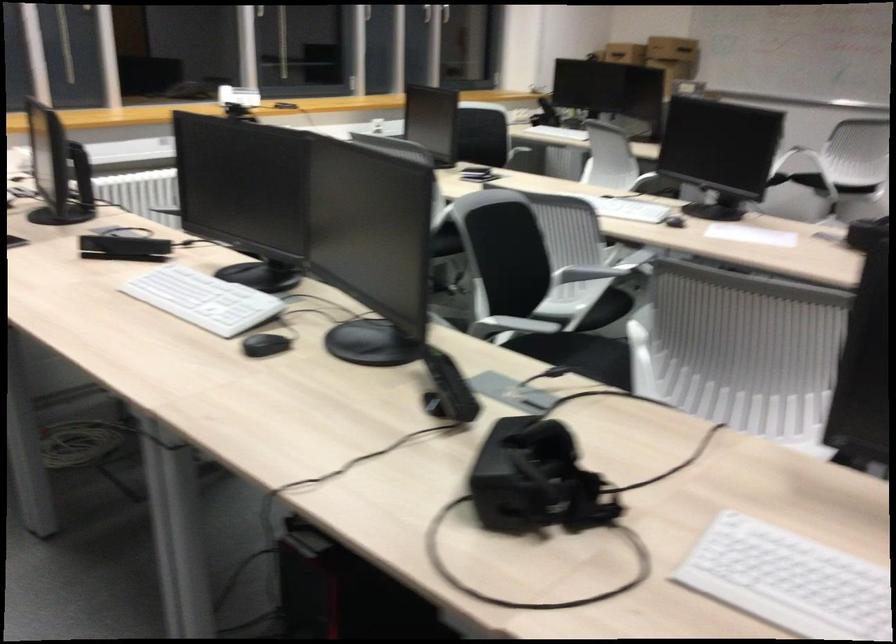
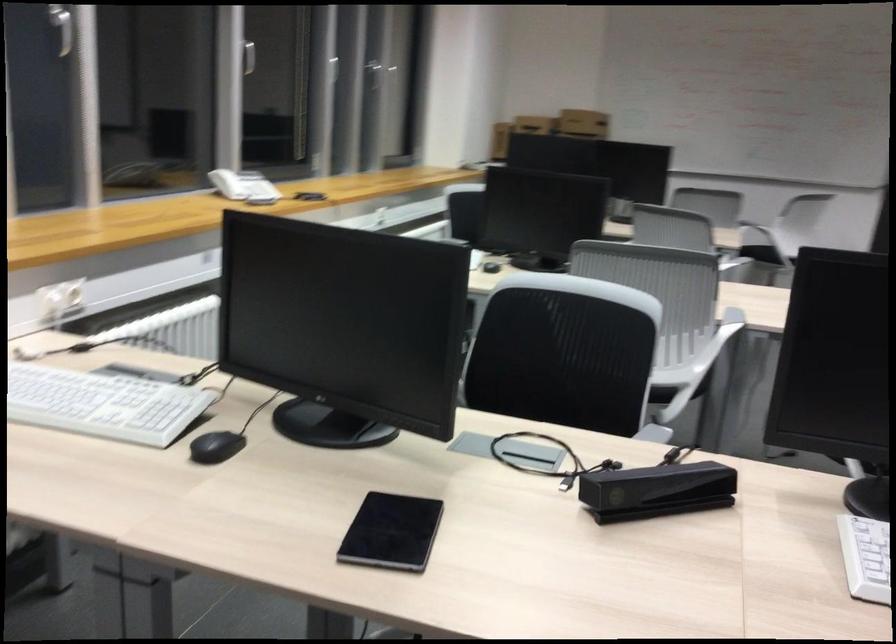
In a continuous first-person perspective shot, in which direction is the camera moving?

The cameraman walked toward left, forward.